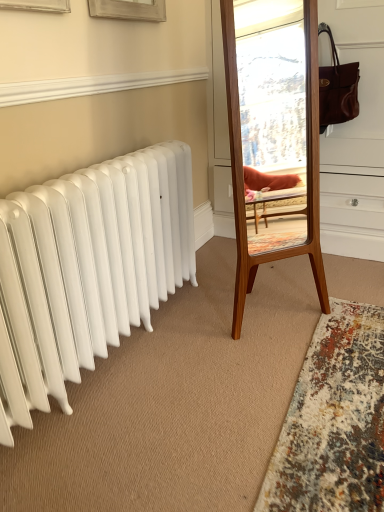
Question: In terms of width, does wooden mirror at center look wider or thinner when compared to white smooth baseboard at upper center?

Choices:
 (A) thin
 (B) wide

Answer: (B)

Question: Is wooden mirror at center inside the boundaries of white smooth baseboard at upper center, or outside?

Choices:
 (A) inside
 (B) outside

Answer: (B)

Question: Which object is positioned farthest from the multicolored shaggy rug at lower right?

Choices:
 (A) white smooth baseboard at upper center
 (B) wooden mirror at center

Answer: (A)

Question: Estimate the real-world distances between objects in this image. Which object is farther from the white smooth baseboard at upper center?

Choices:
 (A) multicolored shaggy rug at lower right
 (B) wooden mirror at center

Answer: (A)